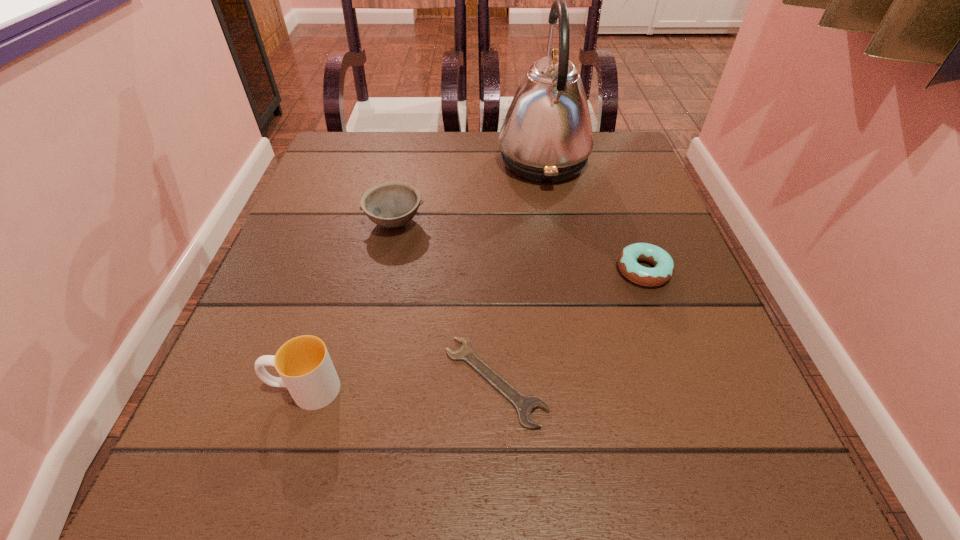
This screenshot has height=540, width=960. I want to click on free location located from the spout of the tallest object, so click(419, 162).

The image size is (960, 540). What are the coordinates of `vacant region located 0.080m with the handle on the side of the cup` in the screenshot? It's located at (214, 389).

Locate an element on the screen. free space located 0.050m with the handle on the side of the cup is located at coordinates (235, 389).

You are a GUI agent. You are given a task and a screenshot of the screen. Output one action in this format:
    pyautogui.click(x=<x>, y=<y>)
    Task: Click on the vacant region located 0.260m on the back of the bowl
    Image resolution: width=960 pixels, height=540 pixels.
    Given the screenshot: What is the action you would take?
    pyautogui.click(x=412, y=143)

I want to click on vacant space situated on the left of the fourth tallest object, so click(x=453, y=271).

Where is `free spot located on the left of the wrench`? The image size is (960, 540). free spot located on the left of the wrench is located at coordinates (342, 381).

The height and width of the screenshot is (540, 960). What are the coordinates of `object that is at the far edge` in the screenshot? It's located at (546, 137).

This screenshot has width=960, height=540. Identify the location of cup present at the left edge. (304, 365).

At what (x,y) coordinates should I click in order to perform the action: click on bowl that is at the left edge. Please return your answer as a coordinate pair (x, y). The image size is (960, 540). Looking at the image, I should click on (392, 204).

The width and height of the screenshot is (960, 540). I want to click on kettle that is at the right edge, so click(x=546, y=137).